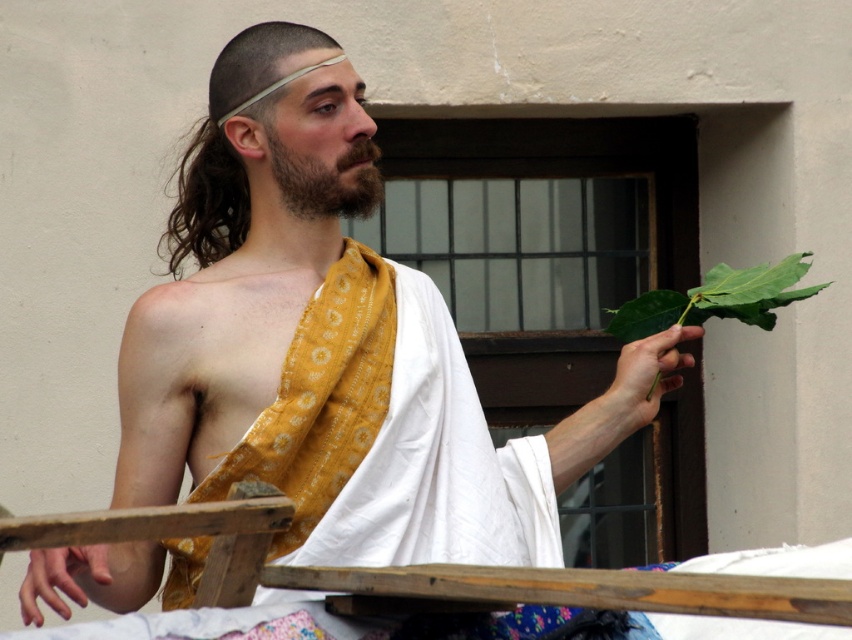
Question: Which object appears farthest from the camera in this image?

Choices:
 (A) green leafy at right
 (B) wooden at lower center

Answer: (A)

Question: Is dark brown thick beard at center bigger than smooth skin hand at lower left?

Choices:
 (A) no
 (B) yes

Answer: (A)

Question: Estimate the real-world distances between objects in this image. Which object is farther from the green leafy stem at right?

Choices:
 (A) smooth skin hand at lower left
 (B) wooden at lower center
 (C) dark brown thick beard at center
 (D) green leafy at right

Answer: (B)

Question: Which point is farther to the camera?

Choices:
 (A) dark brown thick beard at center
 (B) smooth skin hand at lower left
 (C) green leafy at right

Answer: (C)

Question: Can you confirm if green leafy at right is positioned to the left of dark brown thick beard at center?

Choices:
 (A) no
 (B) yes

Answer: (A)

Question: Is green leafy at right positioned in front of dark brown thick beard at center?

Choices:
 (A) yes
 (B) no

Answer: (B)